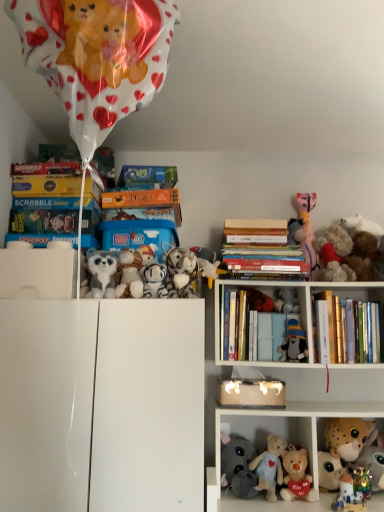
Question: Considering the relative sizes of white plush toy at upper center, which appears as the 3th toy when viewed from the left, and white plush toys at lower center in the image provided, is white plush toy at upper center, which appears as the 3th toy when viewed from the left, taller than white plush toys at lower center?

Choices:
 (A) no
 (B) yes

Answer: (A)

Question: Is white plush toy at upper center, the tenth toy from the right, at the right side of white plush toys at lower center?

Choices:
 (A) no
 (B) yes

Answer: (A)

Question: Is white plush toy at upper center, the tenth toy from the right, oriented away from white plush toys at lower center?

Choices:
 (A) yes
 (B) no

Answer: (B)

Question: Does white plush toy at upper center, which appears as the 3th toy when viewed from the left, lie in front of white plush toys at lower center?

Choices:
 (A) yes
 (B) no

Answer: (B)

Question: Can you confirm if white plush toy at upper center, the tenth toy from the right, is positioned to the left of white plush toys at lower center?

Choices:
 (A) yes
 (B) no

Answer: (A)

Question: Considering their positions, is brown plush toy at upper right, placed as the 1th toy when sorted from right to left, located in front of or behind blue cardboard box at center?

Choices:
 (A) behind
 (B) front

Answer: (A)

Question: From a real-world perspective, is brown plush toy at upper right, placed as the twelfth toy when sorted from left to right, above or below blue cardboard box at center?

Choices:
 (A) below
 (B) above

Answer: (A)

Question: In terms of height, does brown plush toy at upper right, placed as the 1th toy when sorted from right to left, look taller or shorter compared to blue cardboard box at center?

Choices:
 (A) tall
 (B) short

Answer: (A)

Question: Would you say brown plush toy at upper right, placed as the twelfth toy when sorted from left to right, is inside or outside blue cardboard box at center?

Choices:
 (A) outside
 (B) inside

Answer: (A)

Question: From a real-world perspective, is soft plush bear at center, which is the 8th toy from right to left, physically located above or below fluffy plush toys at right, the 3th toy positioned from the right?

Choices:
 (A) below
 (B) above

Answer: (A)

Question: Is soft plush bear at center, which is the 5th toy in left-to-right order, spatially inside fluffy plush toys at right, arranged as the tenth toy when viewed from the left, or outside of it?

Choices:
 (A) inside
 (B) outside

Answer: (B)

Question: In terms of height, does soft plush bear at center, which is the 8th toy from right to left, look taller or shorter compared to fluffy plush toys at right, arranged as the tenth toy when viewed from the left?

Choices:
 (A) short
 (B) tall

Answer: (A)

Question: Considering the positions of soft plush bear at center, which is the 5th toy in left-to-right order, and fluffy plush toys at right, the 3th toy positioned from the right, in the image, is soft plush bear at center, which is the 5th toy in left-to-right order, bigger or smaller than fluffy plush toys at right, the 3th toy positioned from the right,?

Choices:
 (A) big
 (B) small

Answer: (B)

Question: From a real-world perspective, is hardcover books at center, which is the second book from bottom to top, above or below hardcover book at upper center, which appears as the 4th book when viewed from the right?

Choices:
 (A) above
 (B) below

Answer: (B)

Question: From their relative heights in the image, would you say hardcover books at center, the 2th book when ordered from right to left, is taller or shorter than hardcover book at upper center, the 1th book when ordered from left to right?

Choices:
 (A) tall
 (B) short

Answer: (A)